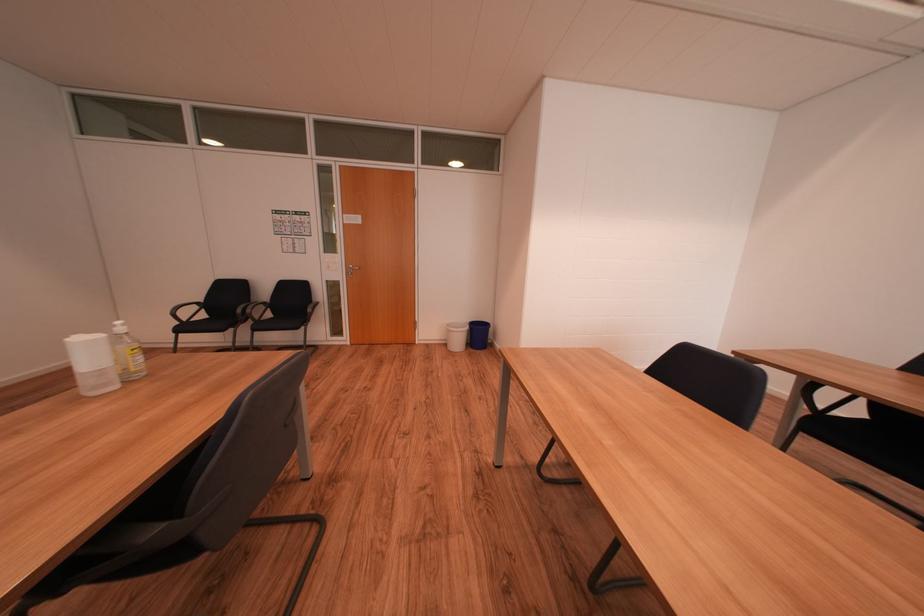
This screenshot has height=616, width=924. What are the coordinates of `black chair sitting surface` in the screenshot? It's located at (867, 440).